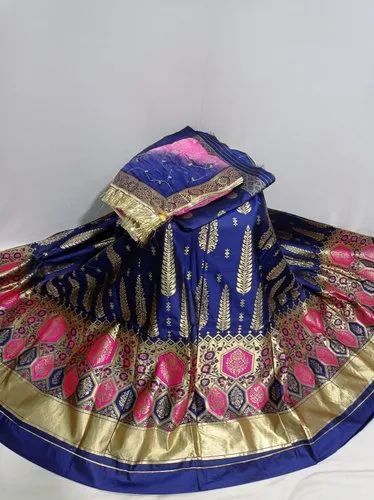
Identify the location of gold trim around bottom fabric. This screenshot has height=500, width=374. (255, 437).